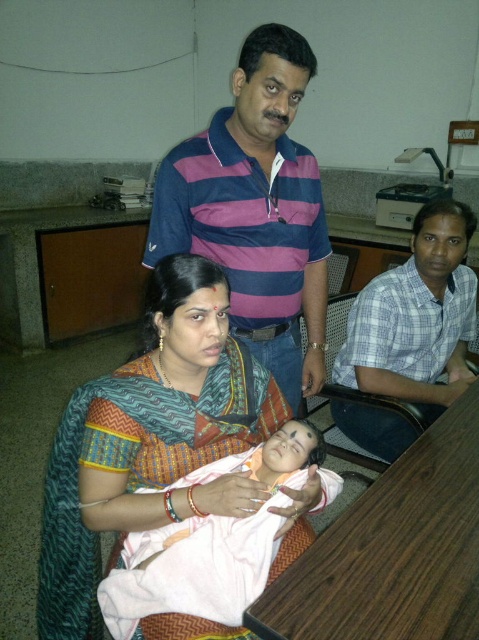
Question: Does purple striped polo shirt at upper center appear on the right side of pink fabric baby at center?

Choices:
 (A) yes
 (B) no

Answer: (A)

Question: Does wooden table at lower center come in front of pink fabric baby at center?

Choices:
 (A) no
 (B) yes

Answer: (B)

Question: Estimate the real-world distances between objects in this image. Which object is farther from the purple striped polo shirt at upper center?

Choices:
 (A) multicolored saree at center
 (B) wooden table at lower center
 (C) pink fabric baby at center

Answer: (B)

Question: Which point is farther from the camera taking this photo?

Choices:
 (A) (378, 426)
 (B) (432, 605)

Answer: (A)

Question: Which of the following is the closest to the observer?

Choices:
 (A) multicolored saree at center
 (B) checkered fabric shirt at right
 (C) pink fabric baby at center
 (D) purple striped polo shirt at upper center

Answer: (C)

Question: Is purple striped polo shirt at upper center below pink fabric baby at center?

Choices:
 (A) yes
 (B) no

Answer: (B)